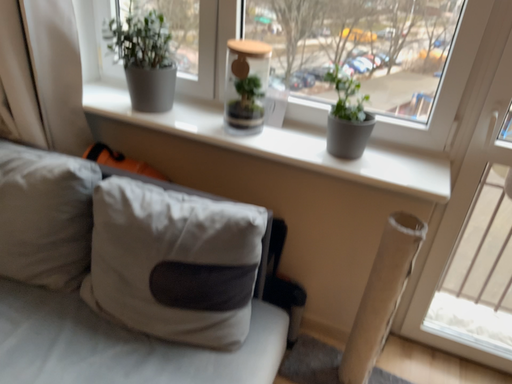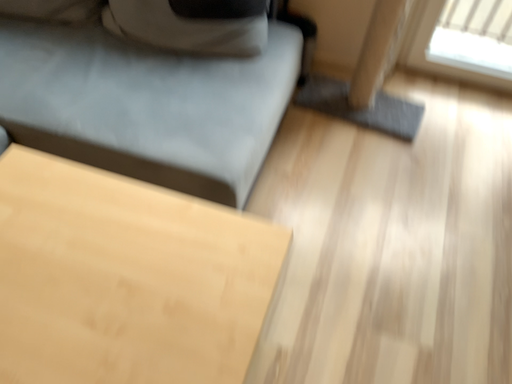
Question: Which way did the camera rotate in the video?

Choices:
 (A) rotated upward
 (B) rotated downward

Answer: (B)